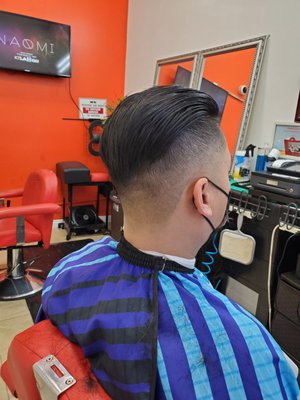
At what (x,y) coordinates should I click in order to perform the action: click on mirror hanging on rack. Please return your answer as a coordinate pair (x, y). This screenshot has width=300, height=400. Looking at the image, I should click on (235, 245).